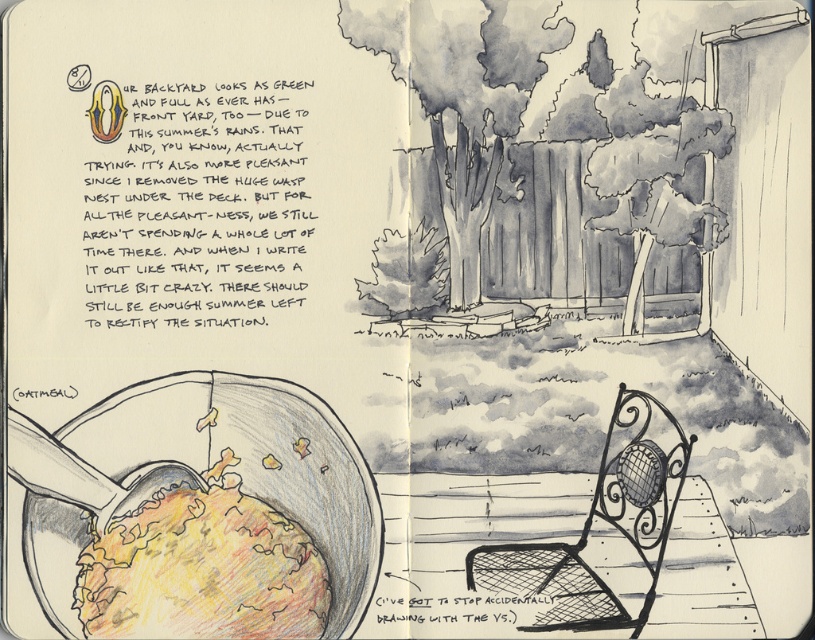
Can you confirm if yellow crumbly food at lower left is bigger than wrought iron chair at center?

No.

Which is in front, point (197, 595) or point (633, 506)?

Point (197, 595) is more forward.

Image resolution: width=815 pixels, height=640 pixels. What do you see at coordinates (201, 570) in the screenshot?
I see `yellow crumbly food at lower left` at bounding box center [201, 570].

The image size is (815, 640). Identify the location of yellow crumbly food at lower left. (201, 570).